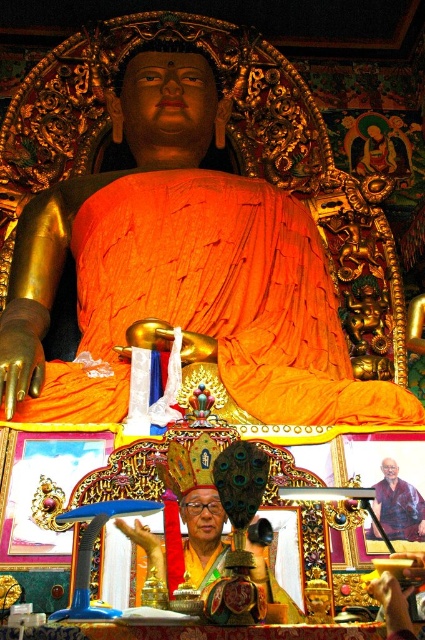
Consider the image. Is golden polished statue at center to the left of matte gold statue at center from the viewer's perspective?

Indeed, golden polished statue at center is positioned on the left side of matte gold statue at center.

Looking at this image, which is below, golden polished statue at center or matte gold statue at center?

Positioned lower is matte gold statue at center.

At what (x,y) coordinates should I click in order to perform the action: click on golden polished statue at center. Please return your answer as a coordinate pair (x, y). The height and width of the screenshot is (640, 425). Looking at the image, I should click on (176, 228).

Locate an element on the screen. This screenshot has height=640, width=425. golden polished statue at center is located at coordinates (176, 228).

Which is more to the right, golden polished statue at center or purple fabric at center?

purple fabric at center is more to the right.

Between golden polished statue at center and purple fabric at center, which one is positioned higher?

Positioned higher is golden polished statue at center.

Which is behind, point (11, 301) or point (393, 476)?

The point (11, 301) is behind.

At what (x,y) coordinates should I click in order to perform the action: click on golden polished statue at center. Please return your answer as a coordinate pair (x, y). This screenshot has height=640, width=425. Looking at the image, I should click on (176, 228).

From the picture: Between purple fabric at center and matte gold statue at center, which one has more height?

With more height is purple fabric at center.

Is point (416, 500) positioned after point (391, 586)?

Yes.

At what (x,y) coordinates should I click in order to perform the action: click on purple fabric at center. Please return your answer as a coordinate pair (x, y). The height and width of the screenshot is (640, 425). Looking at the image, I should click on (399, 504).

Locate an element on the screen. purple fabric at center is located at coordinates (399, 504).